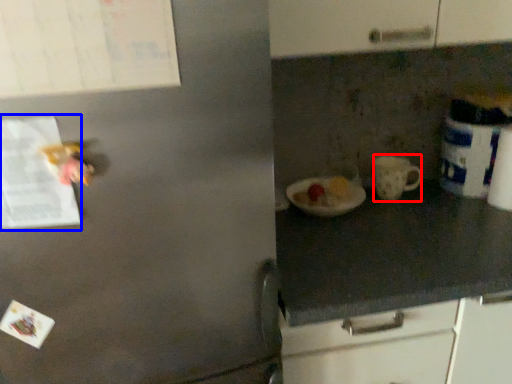
Question: Among these objects, which one is farthest to the camera, mug (highlighted by a red box) or paper (highlighted by a blue box)?

Choices:
 (A) mug
 (B) paper

Answer: (A)